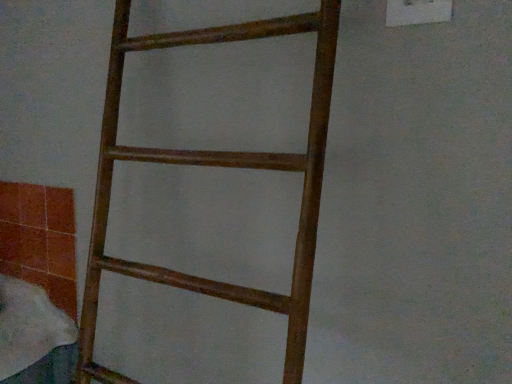
Question: Should I look upward or downward to see wooden ladder at center?

Choices:
 (A) up
 (B) down

Answer: (B)